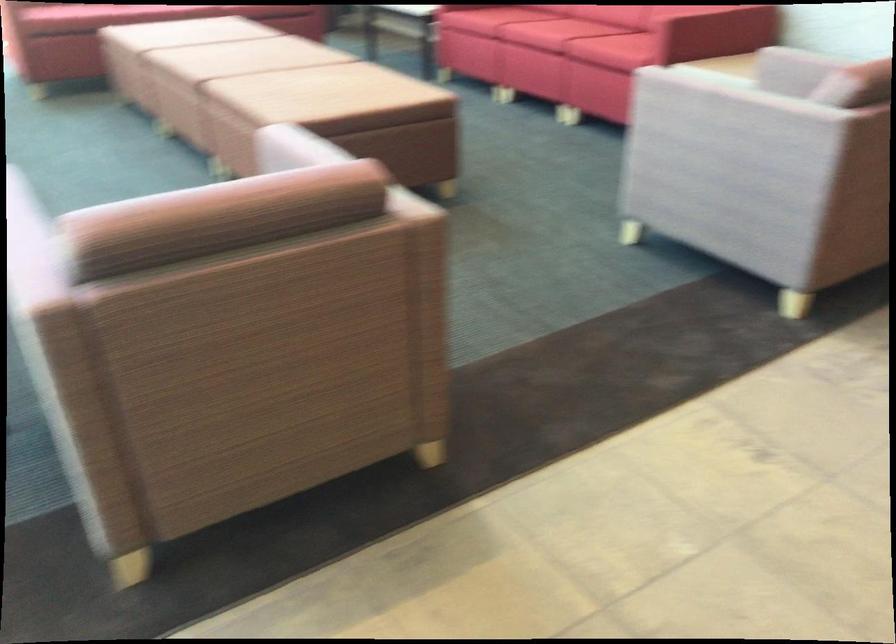
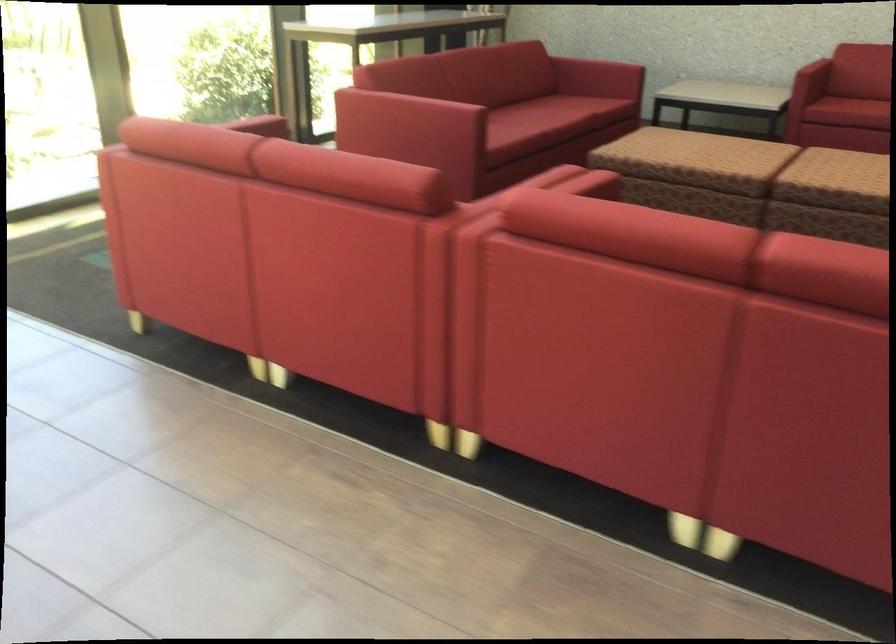
Question: What movement of the cameraman would produce the second image?

Choices:
 (A) Left
 (B) Right
 (C) Forward
 (D) Backward

Answer: (D)